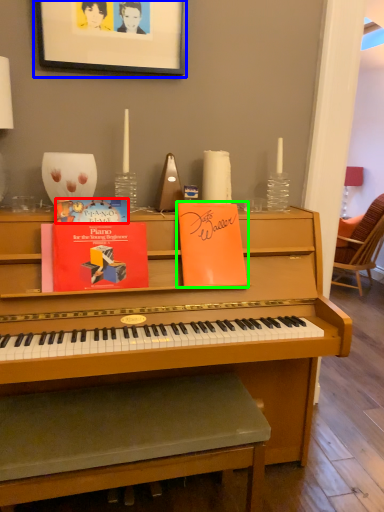
Question: Based on their relative distances, which object is nearer to paperback book (highlighted by a red box)? Choose from picture frame (highlighted by a blue box) and paperback book (highlighted by a green box).

Choices:
 (A) picture frame
 (B) paperback book

Answer: (B)